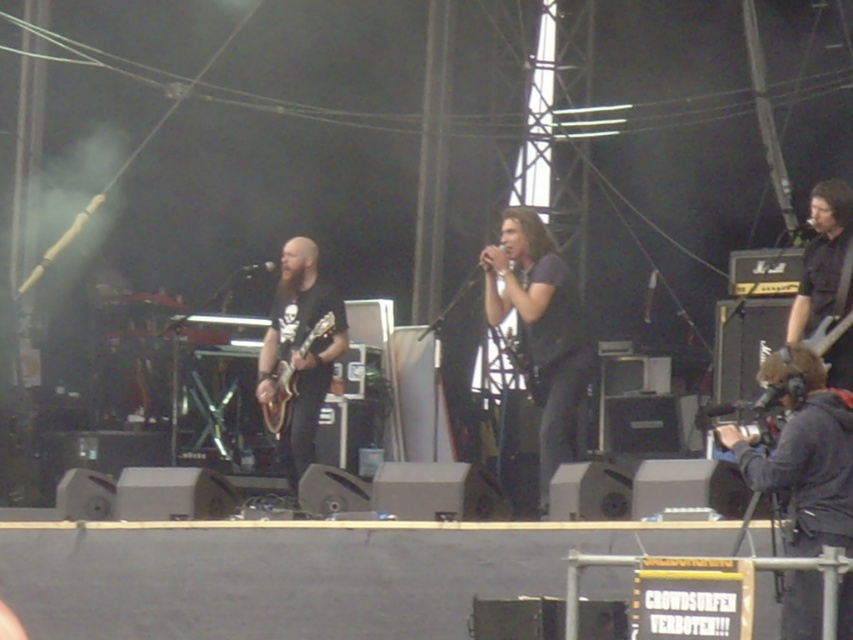
Which of these two, black leather jacket at lower right or metallic silver guitar at right, stands shorter?

Standing shorter between the two is metallic silver guitar at right.

Does black leather jacket at lower right appear on the left side of metallic silver guitar at right?

Correct, you'll find black leather jacket at lower right to the left of metallic silver guitar at right.

Find the location of a particular element. The image size is (853, 640). black leather jacket at lower right is located at coordinates (804, 451).

Who is more distant from viewer, (x=827, y=240) or (x=274, y=374)?

Positioned behind is point (x=274, y=374).

The height and width of the screenshot is (640, 853). What are the coordinates of `black matte guitar at right` in the screenshot? It's located at (822, 259).

Locate an element on the screen. black matte guitar at right is located at coordinates (822, 259).

Can you confirm if dark gray shirt at center is positioned below black matte guitar at center?

Actually, dark gray shirt at center is above black matte guitar at center.

Where is `dark gray shirt at center`? The height and width of the screenshot is (640, 853). dark gray shirt at center is located at coordinates [541, 332].